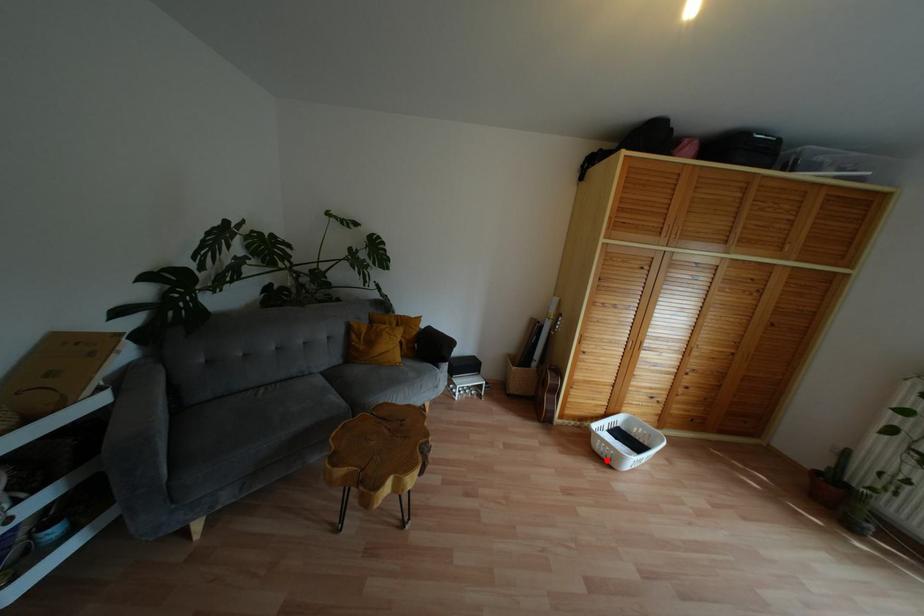
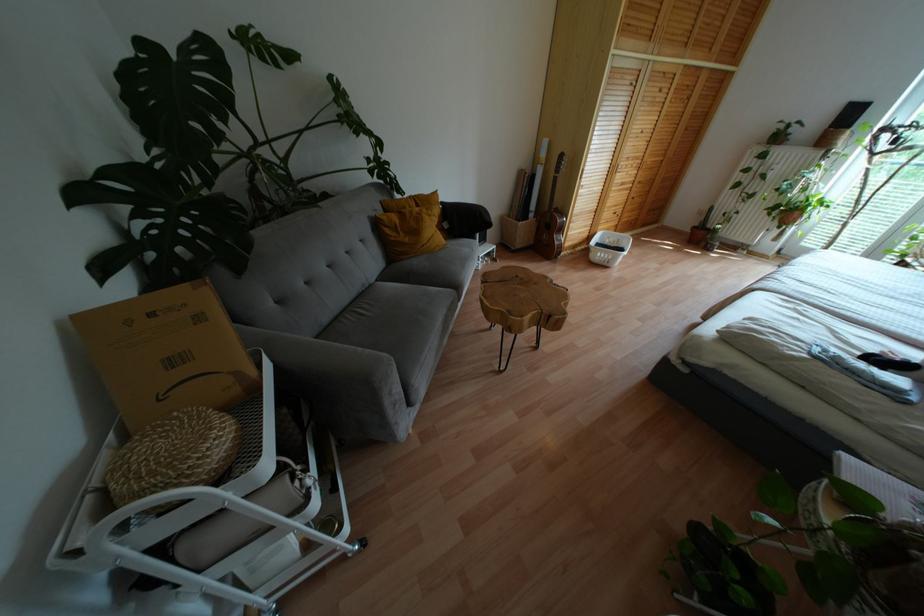
Question: I am providing you with two images of the same scene from different viewpoints. In image1, a red point is highlighted. Considering the same 3D point in image2, which of the following is correct?

Choices:
 (A) It is closer
 (B) It is farther

Answer: (B)